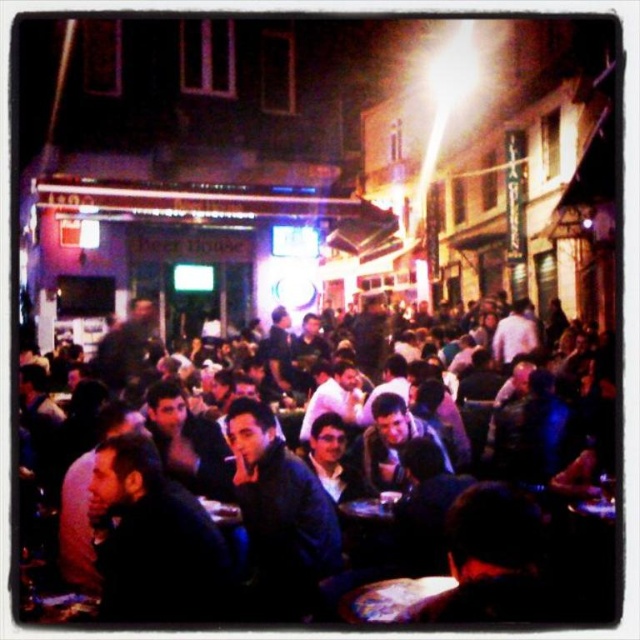
Which is below, dark blue clothing at center or shiny metallic table at center?

Positioned lower is shiny metallic table at center.

Does point (442, 621) lie behind point (429, 586)?

No, (442, 621) is closer to viewer.

Locate an element on the screen. dark blue clothing at center is located at coordinates (326, 502).